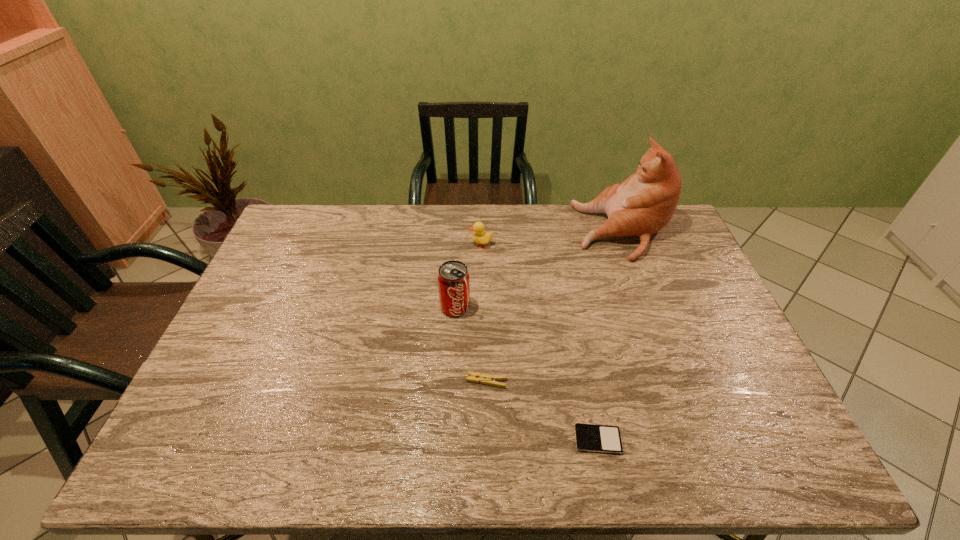
This screenshot has width=960, height=540. Identify the location of free space in the image that satisfies the following two spatial constraints: 1. on the front side of the fourth object from left to right; 2. on the left side of the fourth tallest object. (488, 440).

This screenshot has height=540, width=960. I want to click on vacant position in the image that satisfies the following two spatial constraints: 1. on the front-facing side of the duckling; 2. on the right side of the fourth farthest object, so click(481, 381).

Identify the location of vacant space that satisfies the following two spatial constraints: 1. on the face of the cat; 2. on the front side of the third nearest object. Image resolution: width=960 pixels, height=540 pixels. (651, 307).

Identify the location of vacant position in the image that satisfies the following two spatial constraints: 1. on the front-facing side of the duckling; 2. on the right side of the iPod. The width and height of the screenshot is (960, 540). (481, 440).

The image size is (960, 540). What are the coordinates of `free space that satisfies the following two spatial constraints: 1. on the front side of the clothespin; 2. on the right side of the second object from right to left` in the screenshot? It's located at (488, 440).